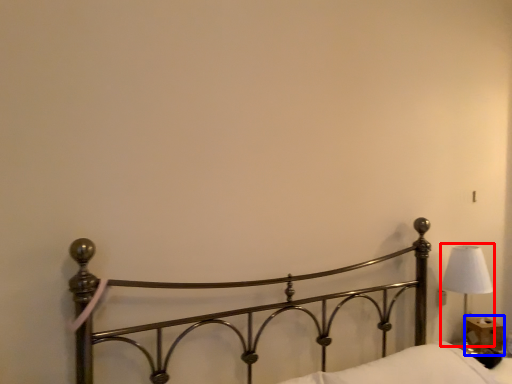
Question: Which object is further to the camera taking this photo, lamp (highlighted by a red box) or table (highlighted by a blue box)?

Choices:
 (A) lamp
 (B) table

Answer: (B)